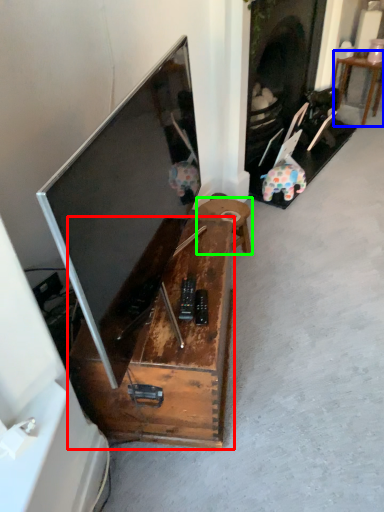
Question: Based on their relative distances, which object is nearer to furniture (highlighted by a red box)? Choose from table (highlighted by a blue box) and table (highlighted by a green box).

Choices:
 (A) table
 (B) table

Answer: (B)